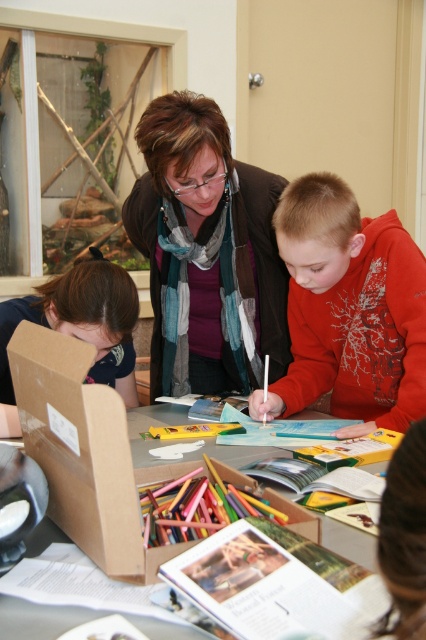
You are a student sitting at the table and need to reach two points marked on the table. The first point is at coordinate point (92,397) and the second is at point (284,524). Which point will you reach first if you move straight towards them from your current position?

Point (92,397) is in front of point (284,524), so you will reach point (92,397) first.